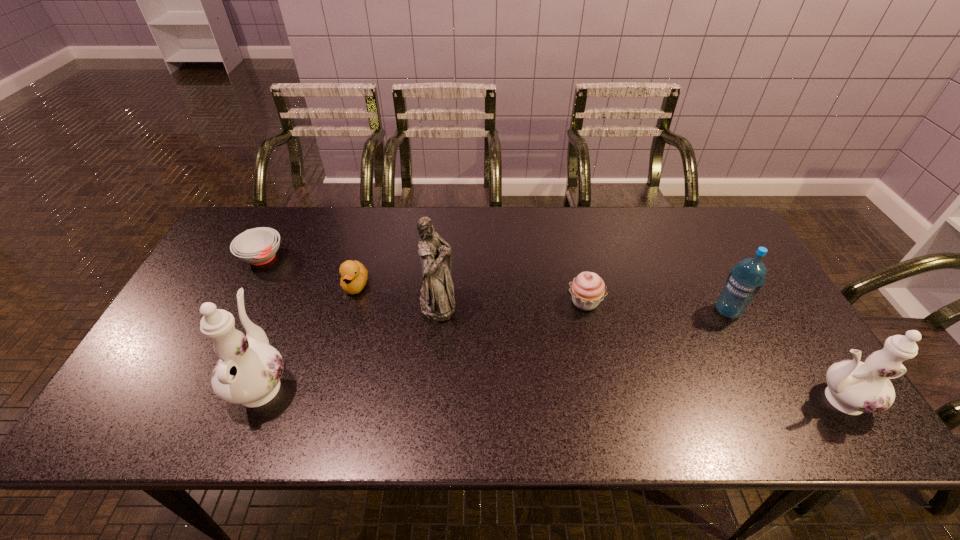
Identify the location of vacant area situated 0.140m at the spout of the left chinaware. coord(292,308).

Where is `free location located 0.120m at the spout of the left chinaware`? The image size is (960, 540). free location located 0.120m at the spout of the left chinaware is located at coordinates (290, 313).

In order to click on vacant space positioned 0.370m at the spout of the left chinaware in this screenshot , I will do `click(314, 252)`.

This screenshot has width=960, height=540. I want to click on vacant position located at the spout of the right chinaware, so click(708, 400).

Locate an element on the screen. vacant space located at the spout of the right chinaware is located at coordinates (638, 400).

At what (x,y) coordinates should I click in order to perform the action: click on free space located 0.080m at the spout of the right chinaware. Please return your answer as a coordinate pair (x, y). The width and height of the screenshot is (960, 540). Looking at the image, I should click on (768, 400).

The height and width of the screenshot is (540, 960). In order to click on blank space located facing forward on the third object from left to right in this screenshot , I will do `click(329, 381)`.

The image size is (960, 540). Identify the location of free space located 0.360m on the back of the water bottle. (681, 221).

At what (x,y) coordinates should I click in order to perform the action: click on free space located 0.310m on the right of the shortest object. Please return your answer as a coordinate pair (x, y). The height and width of the screenshot is (540, 960). Looking at the image, I should click on (385, 257).

Where is `vacant space situated 0.170m on the back of the cupcake`? vacant space situated 0.170m on the back of the cupcake is located at coordinates (573, 249).